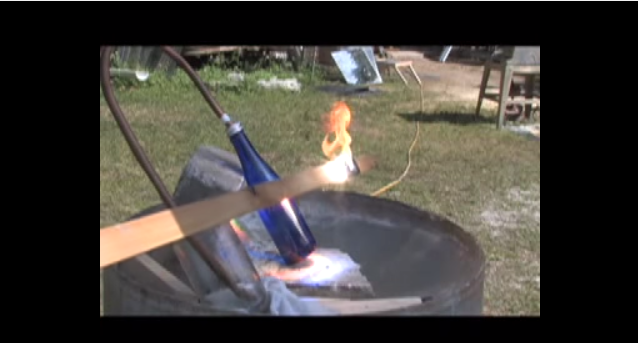
I want to click on 1 table on the right, so pyautogui.click(x=508, y=76).